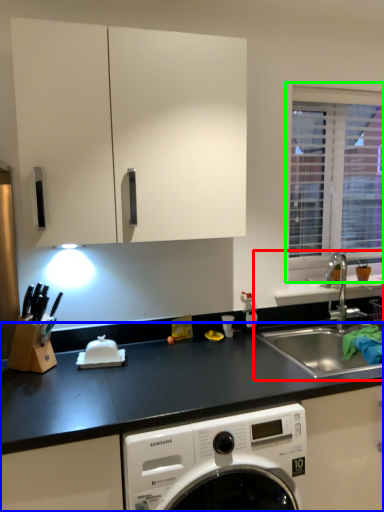
Question: Based on their relative distances, which object is farther from sink (highlighted by a red box)? Choose from countertop (highlighted by a blue box) and window (highlighted by a green box).

Choices:
 (A) countertop
 (B) window

Answer: (A)